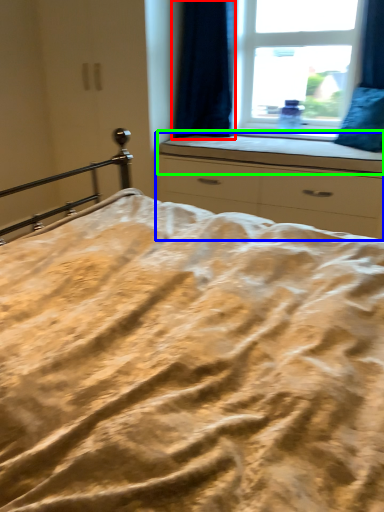
Question: Which is farther away from curtain (highlighted by a red box)? chest of drawers (highlighted by a blue box) or window sill (highlighted by a green box)?

Choices:
 (A) chest of drawers
 (B) window sill

Answer: (A)